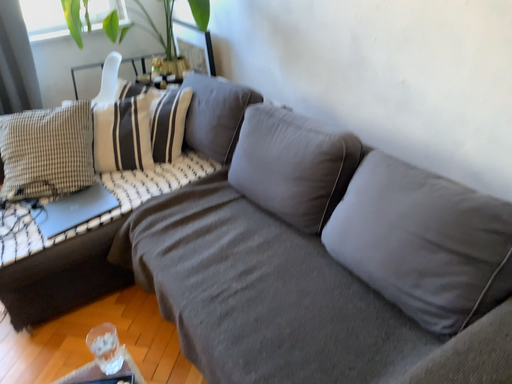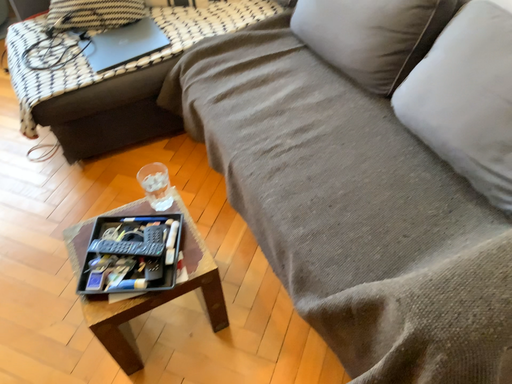
Question: Which way did the camera rotate in the video?

Choices:
 (A) rotated downward
 (B) rotated upward

Answer: (A)